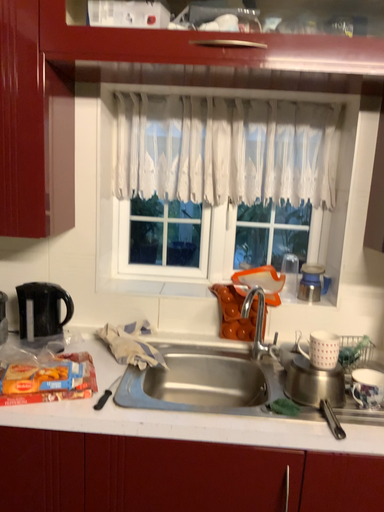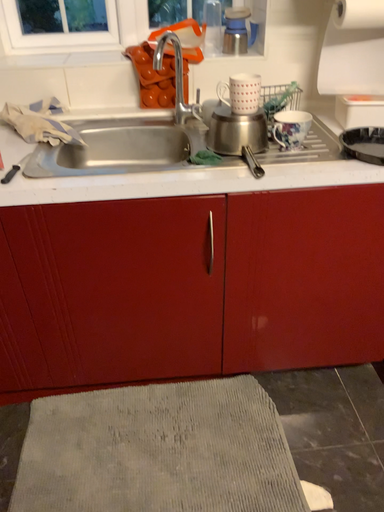
Question: How did the camera likely rotate when shooting the video?

Choices:
 (A) rotated upward
 (B) rotated downward

Answer: (B)